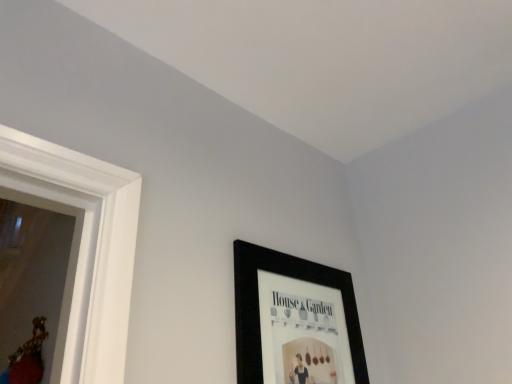
Where is `black matte picture frame at upper right`? This screenshot has width=512, height=384. black matte picture frame at upper right is located at coordinates (294, 321).

The height and width of the screenshot is (384, 512). What do you see at coordinates (294, 321) in the screenshot? I see `black matte picture frame at upper right` at bounding box center [294, 321].

Measure the distance between black matte picture frame at upper right and camera.

They are 96.40 centimeters apart.

Find the location of a particular element. black matte picture frame at upper right is located at coordinates (294, 321).